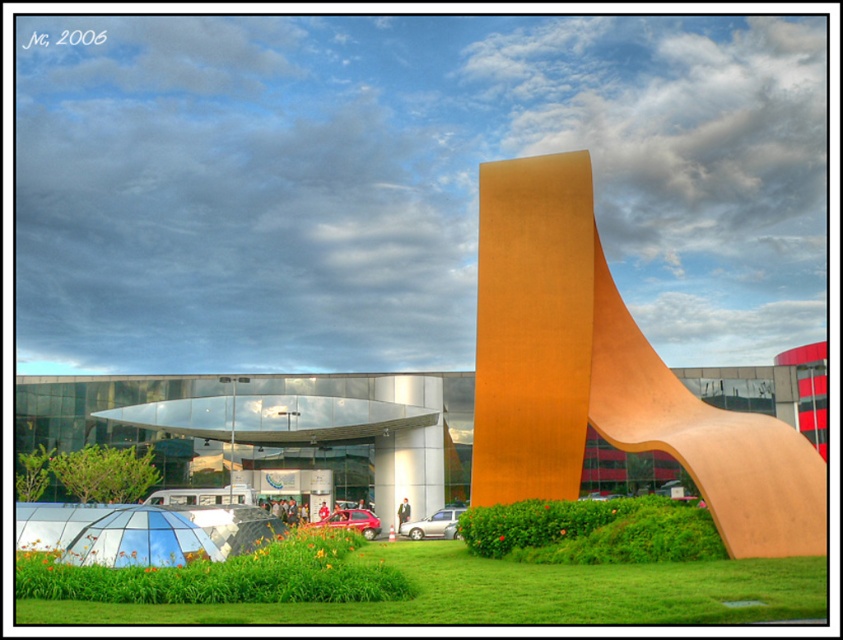
You are standing in the modern architectural scene and want to place a small decorative rock. You have two options for placement near the green grass at lower center and the green leafy bush at center. Which location would be closer to you?

The green grass at lower center is closer to the viewer than the green leafy bush at center, so placing the rock near the green grass at lower center would be closer to you.